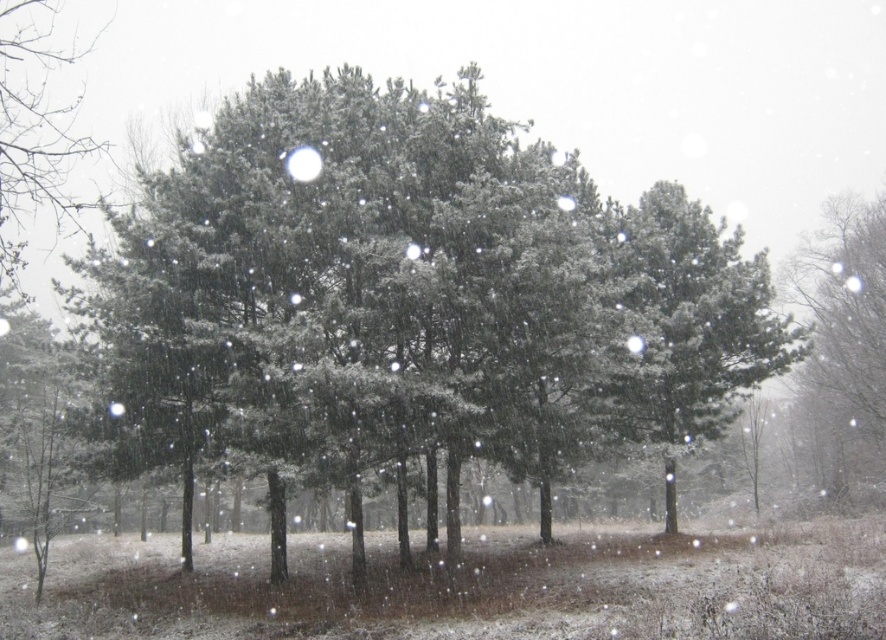
You are standing in the winter scene and want to walk from your current position to a point in the image. Which of the two points, point (x=882, y=374) or point (x=33, y=129), would you reach first if you move straight ahead?

Point (x=882, y=374) is in front of point (x=33, y=129), so you would reach point (x=882, y=374) first if you move straight ahead.